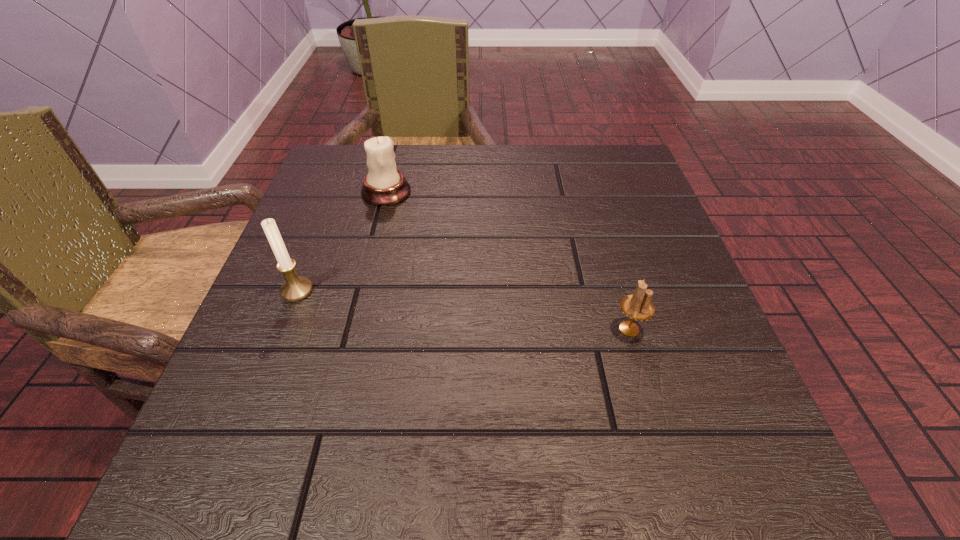
Where is `the leftmost object`? This screenshot has height=540, width=960. the leftmost object is located at coordinates (295, 288).

Identify the location of the leftmost candle holder. (295, 288).

Locate an element on the screen. Image resolution: width=960 pixels, height=540 pixels. the second candle holder from left to right is located at coordinates (384, 185).

Locate an element on the screen. Image resolution: width=960 pixels, height=540 pixels. the second object from right to left is located at coordinates (384, 185).

Find the location of a particular element. The height and width of the screenshot is (540, 960). the nearest object is located at coordinates (638, 306).

Identify the location of the rightmost object. (638, 306).

Find the location of a particular element. The height and width of the screenshot is (540, 960). free location located on the back of the second nearest object is located at coordinates (346, 165).

Identify the location of vacant space located on the right of the farthest candle holder. Image resolution: width=960 pixels, height=540 pixels. (439, 192).

This screenshot has height=540, width=960. What are the coordinates of `free location located 0.140m on the left of the rightmost object` in the screenshot? It's located at (525, 329).

I want to click on object at the far edge, so click(x=384, y=185).